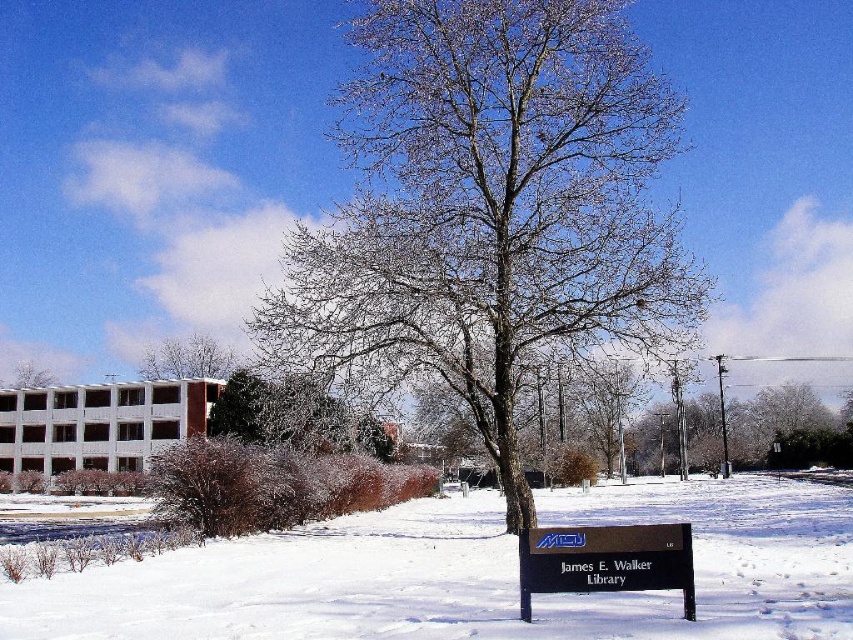
You are standing at the point closer to the camera in the image. Which point are you at, point (521, 186) or point (26, 365)?

You are at point (521, 186) because it is closer to the camera than point (26, 365).

You are standing at the point marked by the coordinate point at (490, 205). What object are you directly in front of?

You are directly in front of the snow covered tree at center, as the point (490, 205) represents the location of the snow covered tree at center.